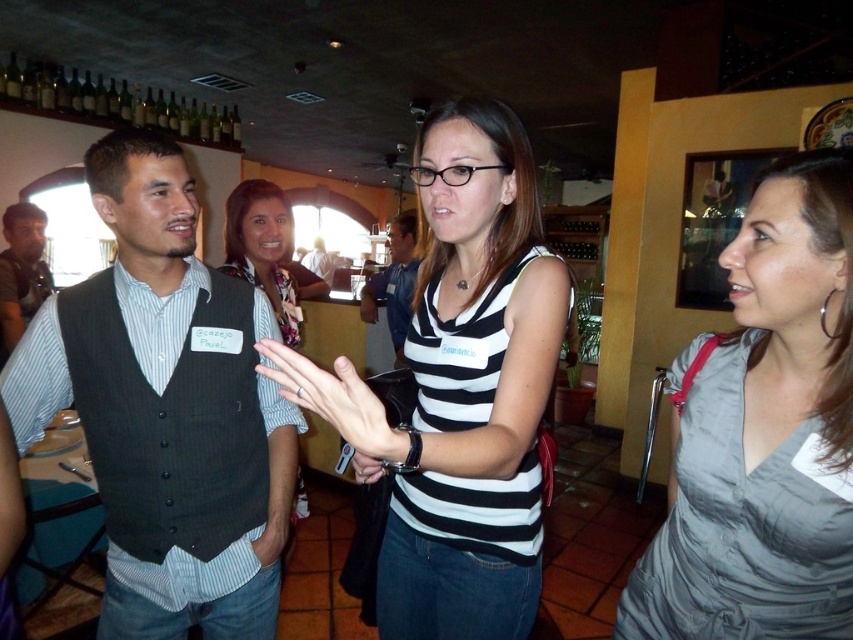
In the scene shown: You are a fashion designer observing the image. You need to determine which clothing item is bigger between the black and white striped tank top at center and the matte black vest at left. Which one is larger?

The black and white striped tank top at center has a larger size compared to the matte black vest at left, so the black and white striped tank top at center is larger.

You are standing in the social gathering scene and want to take a photo of both point (467,484) and point (376,301). Which point should you focus on first to ensure both are in clear view?

Point (467,484) is closer to the camera than point (376,301). To ensure both are in clear view, focus on the closer point first, which is point (467,484).